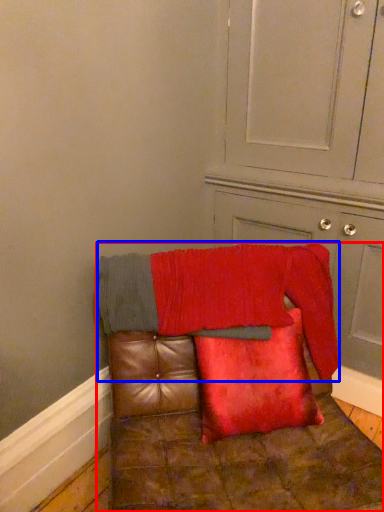
Question: Among these objects, which one is farthest to the camera, furniture (highlighted by a red box) or blanket (highlighted by a blue box)?

Choices:
 (A) furniture
 (B) blanket

Answer: (B)